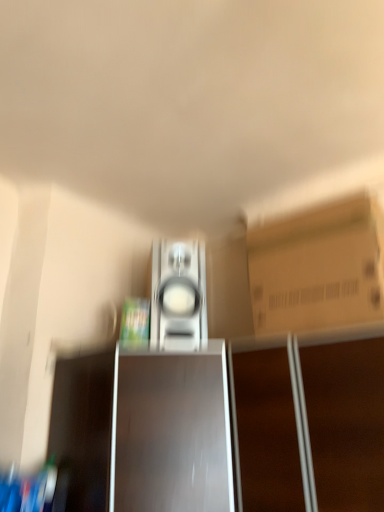
Question: Would you say shiny brown cabinet at center is part of satin silver speaker at center's contents?

Choices:
 (A) no
 (B) yes

Answer: (A)

Question: Does satin silver speaker at center have a lesser width compared to shiny brown cabinet at center?

Choices:
 (A) no
 (B) yes

Answer: (B)

Question: Considering the relative positions of satin silver speaker at center and shiny brown cabinet at center in the image provided, is satin silver speaker at center in front of shiny brown cabinet at center?

Choices:
 (A) no
 (B) yes

Answer: (A)

Question: From a real-world perspective, is satin silver speaker at center located higher than shiny brown cabinet at center?

Choices:
 (A) no
 (B) yes

Answer: (B)

Question: From the image's perspective, is satin silver speaker at center under shiny brown cabinet at center?

Choices:
 (A) no
 (B) yes

Answer: (A)

Question: Can you confirm if satin silver speaker at center is shorter than shiny brown cabinet at center?

Choices:
 (A) no
 (B) yes

Answer: (B)

Question: From a real-world perspective, is shiny brown cabinet at center over brown cardboard box at upper right?

Choices:
 (A) yes
 (B) no

Answer: (B)

Question: From a real-world perspective, does shiny brown cabinet at center sit lower than brown cardboard box at upper right?

Choices:
 (A) yes
 (B) no

Answer: (A)

Question: Can you confirm if shiny brown cabinet at center is positioned to the right of brown cardboard box at upper right?

Choices:
 (A) no
 (B) yes

Answer: (A)

Question: Can you see shiny brown cabinet at center touching brown cardboard box at upper right?

Choices:
 (A) no
 (B) yes

Answer: (A)

Question: Can you confirm if shiny brown cabinet at center is smaller than brown cardboard box at upper right?

Choices:
 (A) no
 (B) yes

Answer: (A)

Question: Is the depth of shiny brown cabinet at center greater than that of brown cardboard box at upper right?

Choices:
 (A) no
 (B) yes

Answer: (A)

Question: From the image's perspective, is brown cardboard box at upper right below shiny brown cabinet at center?

Choices:
 (A) no
 (B) yes

Answer: (A)